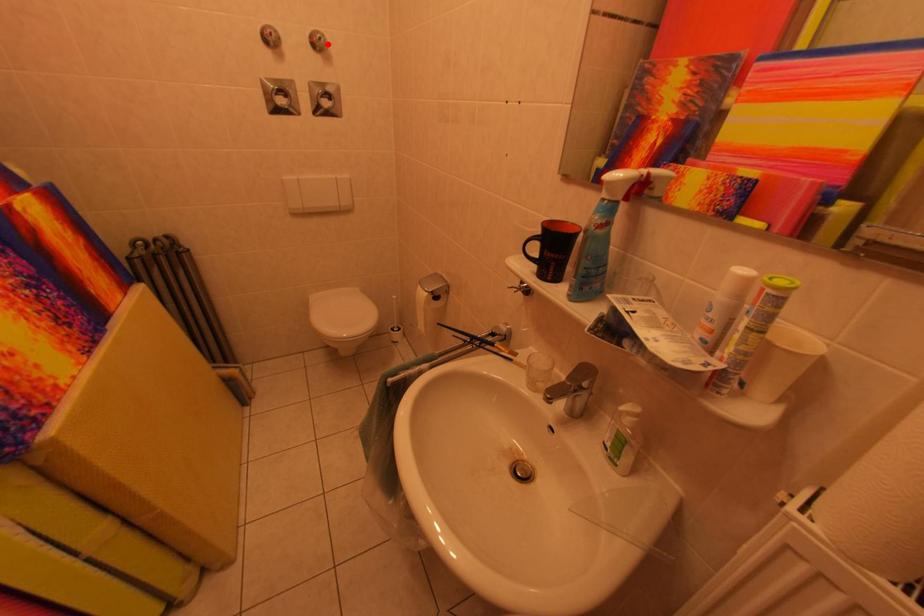
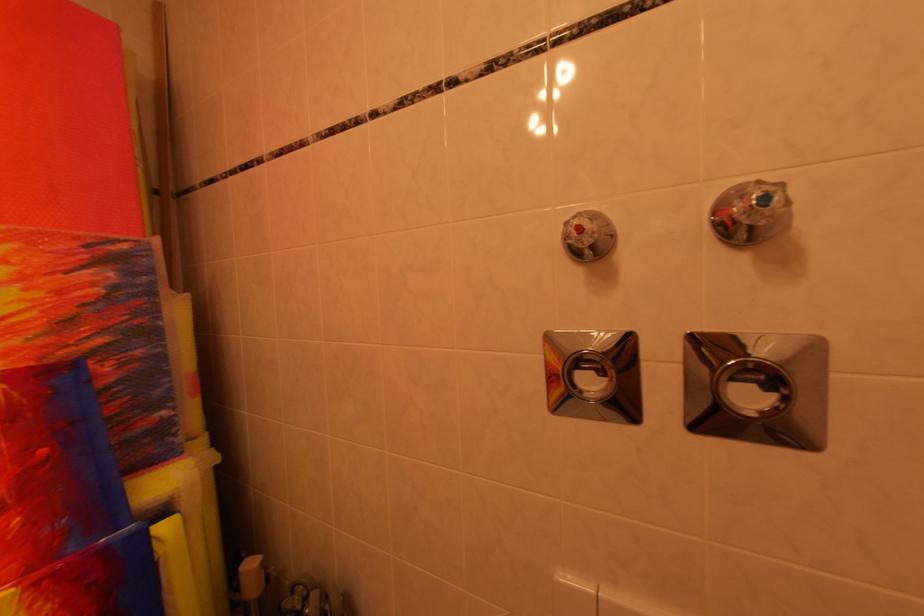
Question: I am providing you with two images of the same scene from different viewpoints. Given a red point in image1, look at the same physical point in image2. Is it:

Choices:
 (A) Closer to the viewpoint
 (B) Farther from the viewpoint

Answer: (A)